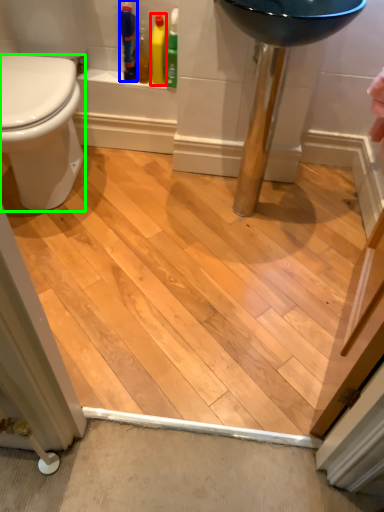
Question: Based on their relative distances, which object is nearer to cleaning product (highlighted by a red box)? Choose from toiletry (highlighted by a blue box) and bidet (highlighted by a green box).

Choices:
 (A) toiletry
 (B) bidet

Answer: (A)